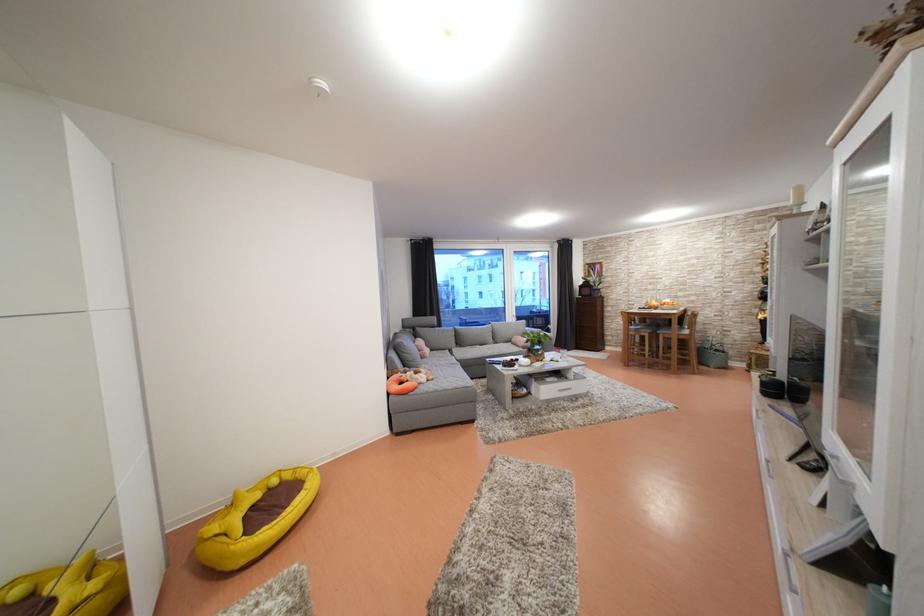
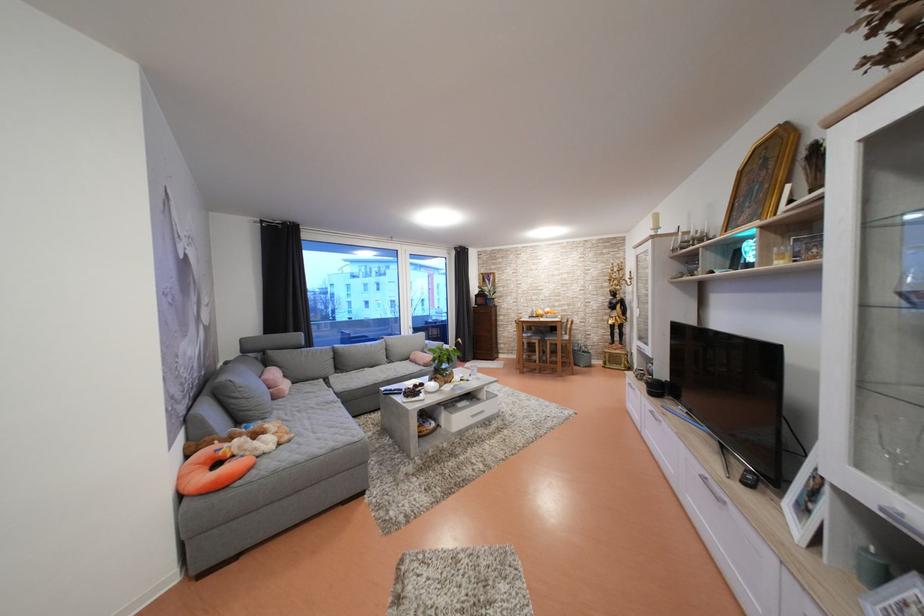
Question: The images are taken continuously from a first-person perspective. In which direction are you moving?

Choices:
 (A) Left
 (B) Right
 (C) Forward
 (D) Backward

Answer: (C)